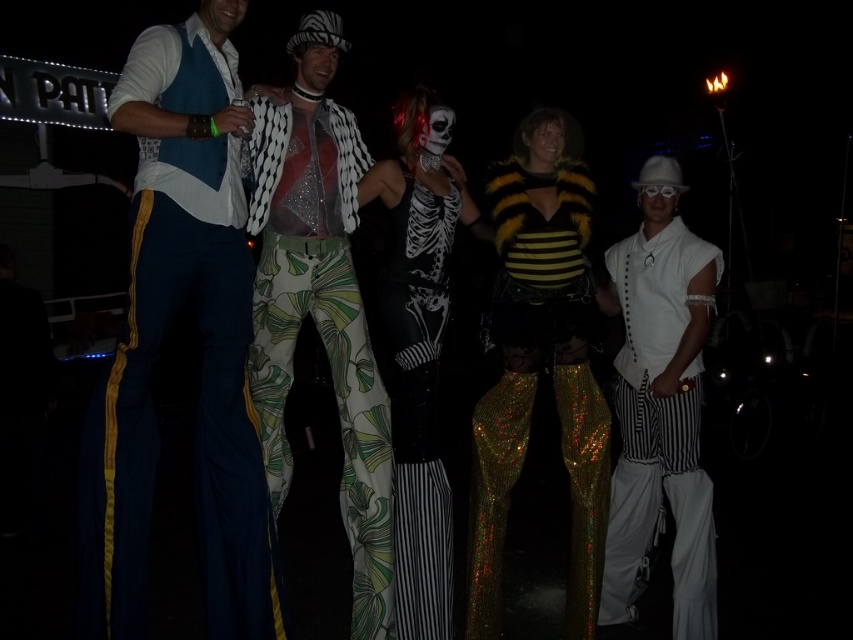
Can you confirm if shiny sequined pants at center is taller than white matte shirt at center?

Yes, shiny sequined pants at center is taller than white matte shirt at center.

Find the location of a particular element. Image resolution: width=853 pixels, height=640 pixels. shiny sequined pants at center is located at coordinates (320, 323).

Is point (318, 20) positioned in front of point (683, 445)?

Yes, it is.

Identify the location of shiny sequined pants at center. Image resolution: width=853 pixels, height=640 pixels. pyautogui.click(x=320, y=323).

Does matte white face at center appear on the right side of matte black mask at center?

Incorrect, matte white face at center is not on the right side of matte black mask at center.

Can you confirm if matte white face at center is positioned to the left of matte black mask at center?

Indeed, matte white face at center is positioned on the left side of matte black mask at center.

Who is more distant from viewer, (318, 83) or (554, 140)?

The point (554, 140) is behind.

Identify the location of matte white face at center. (315, 67).

Can you confirm if matte blue pants at left is taller than matte black mask at center?

Correct, matte blue pants at left is much taller as matte black mask at center.

Where is `matte blue pants at left`? matte blue pants at left is located at coordinates (160, 348).

The image size is (853, 640). In order to click on matte blue pants at left in this screenshot , I will do `click(160, 348)`.